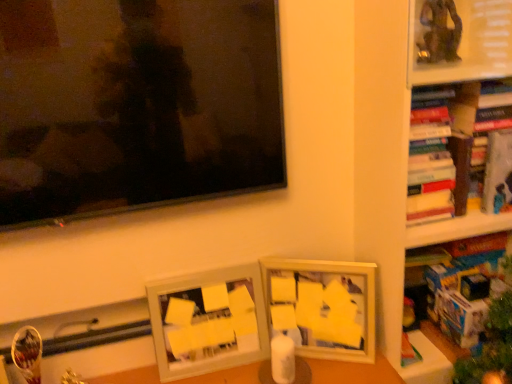
Question: Is white matte picture frame at center, which is counted as the 1th picture frame, starting from the left, to the right of matte black television at upper left from the viewer's perspective?

Choices:
 (A) no
 (B) yes

Answer: (B)

Question: Can you see white matte picture frame at center, which is the 2th picture frame from right to left, touching matte black television at upper left?

Choices:
 (A) no
 (B) yes

Answer: (A)

Question: From a real-world perspective, is white matte picture frame at center, which is counted as the 1th picture frame, starting from the left, below matte black television at upper left?

Choices:
 (A) no
 (B) yes

Answer: (B)

Question: Is white matte picture frame at center, which is counted as the 1th picture frame, starting from the left, shorter than matte black television at upper left?

Choices:
 (A) no
 (B) yes

Answer: (B)

Question: Is white matte picture frame at center, which is the 2th picture frame from right to left, thinner than matte black television at upper left?

Choices:
 (A) no
 (B) yes

Answer: (A)

Question: Would you say white matte picture frame at center, which is the 2th picture frame from right to left, is to the left or to the right of matte white picture frame at center, arranged as the 1th picture frame when viewed from the right, in the picture?

Choices:
 (A) left
 (B) right

Answer: (A)

Question: From their relative heights in the image, would you say white matte picture frame at center, which is counted as the 1th picture frame, starting from the left, is taller or shorter than matte white picture frame at center, the 2th picture frame when ordered from left to right?

Choices:
 (A) tall
 (B) short

Answer: (A)

Question: Choose the correct answer: Is white matte picture frame at center, which is the 2th picture frame from right to left, inside matte white picture frame at center, the 2th picture frame when ordered from left to right, or outside it?

Choices:
 (A) inside
 (B) outside

Answer: (B)

Question: In terms of size, does white matte picture frame at center, which is the 2th picture frame from right to left, appear bigger or smaller than matte white picture frame at center, arranged as the 1th picture frame when viewed from the right?

Choices:
 (A) big
 (B) small

Answer: (A)

Question: Is wooden bookshelf at right taller or shorter than matte black television at upper left?

Choices:
 (A) short
 (B) tall

Answer: (B)

Question: Looking at their shapes, would you say wooden bookshelf at right is wider or thinner than matte black television at upper left?

Choices:
 (A) thin
 (B) wide

Answer: (B)

Question: In the image, is wooden bookshelf at right positioned in front of or behind matte black television at upper left?

Choices:
 (A) front
 (B) behind

Answer: (B)

Question: Is point (x=450, y=203) positioned closer to the camera than point (x=124, y=46)?

Choices:
 (A) farther
 (B) closer

Answer: (A)

Question: In terms of size, does matte black television at upper left appear bigger or smaller than matte white picture frame at center, arranged as the 1th picture frame when viewed from the right?

Choices:
 (A) big
 (B) small

Answer: (A)

Question: Based on their positions, is matte black television at upper left located to the left or right of matte white picture frame at center, arranged as the 1th picture frame when viewed from the right?

Choices:
 (A) left
 (B) right

Answer: (A)